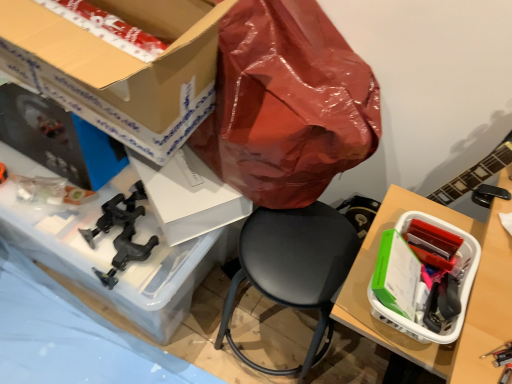
Question: Considering the positions of point (159, 29) and point (373, 309), is point (159, 29) closer or farther from the camera than point (373, 309)?

Choices:
 (A) closer
 (B) farther

Answer: (B)

Question: Would you say cardboard box at upper left, which is the first box in top-to-bottom order, is to the left or to the right of white plastic basket at right, the first box when ordered from right to left, in the picture?

Choices:
 (A) left
 (B) right

Answer: (A)

Question: Estimate the real-world distances between objects in this image. Which object is closer to the clear plastic container at lower left?

Choices:
 (A) black leather chair at center
 (B) cardboard box at upper left, the 1th box viewed from the left
 (C) white plastic basket at right, the first box when ordered from right to left

Answer: (A)

Question: Which is farther from the clear plastic container at lower left?

Choices:
 (A) black leather chair at center
 (B) white plastic basket at right, the 1th box positioned from the bottom
 (C) cardboard box at upper left, the 1th box viewed from the left

Answer: (B)